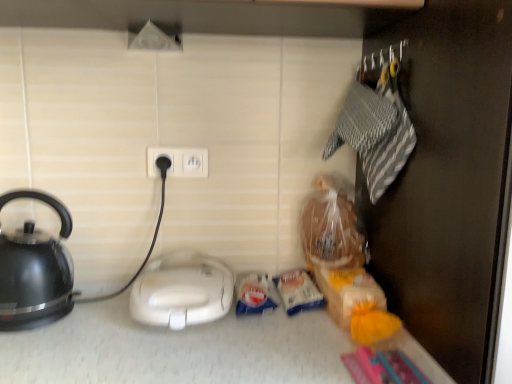
Question: From a real-world perspective, is black glossy kettle at left above or below white plastic socket at center?

Choices:
 (A) below
 (B) above

Answer: (A)

Question: Considering the positions of point (53, 278) and point (179, 172), is point (53, 278) closer or farther from the camera than point (179, 172)?

Choices:
 (A) farther
 (B) closer

Answer: (B)

Question: Which is nearer to the black glossy kettle at left?

Choices:
 (A) white plastic socket at center
 (B) white plastic sandwich maker at center

Answer: (B)

Question: Which object is positioned farthest from the white plastic sandwich maker at center?

Choices:
 (A) black glossy kettle at left
 (B) white plastic socket at center

Answer: (B)